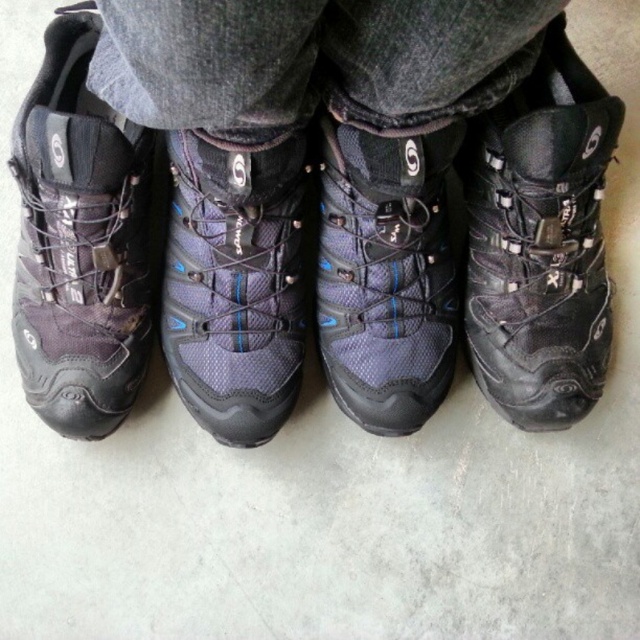
You are a hiker who wants to put on both the black leather boot at right and the matte blue mesh boot at center. Which boot should you put on first according to their current positions?

The black leather boot at right is positioned over the matte blue mesh boot at center, so you should put on the matte blue mesh boot at center first before the black leather boot at right to avoid having to remove the top one first.

You are standing in front of the two black hiking boots. The boot at the right is at point (540, 241). If you want to touch the boot at the right, which coordinate should you aim for?

The black leather boot at right is located at point (540, 241), so you should aim for that coordinate to touch it.

You are planning to buy a pair of boots for your hiking trip. You see two options in the store display, the matte black hiking boots at center and the black leather boot at right. Which one is bigger in size?

The matte black hiking boots at center has a larger size compared to the black leather boot at right.